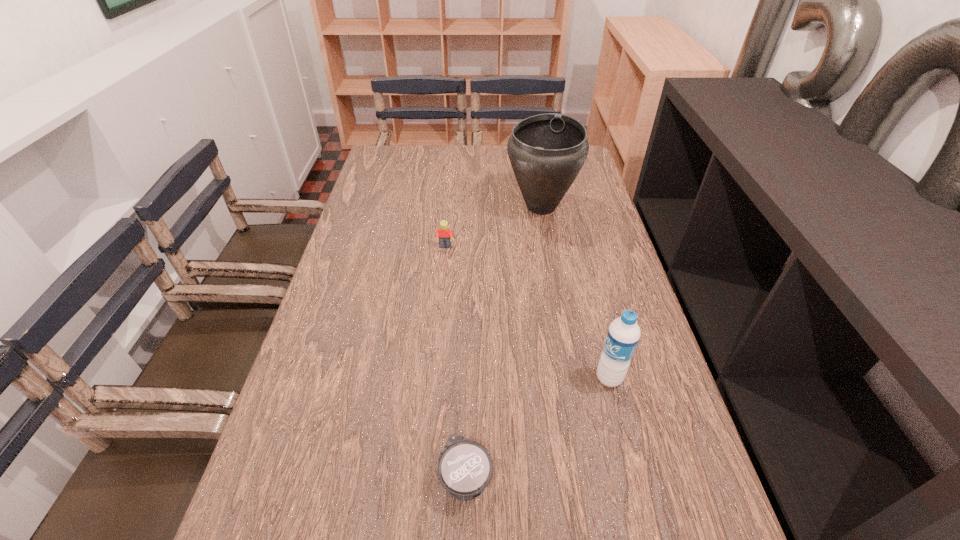
Identify the location of free spot between the third tallest object and the farthest object. The height and width of the screenshot is (540, 960). (493, 227).

Identify the location of free spot between the second farthest object and the water bottle. (527, 313).

Identify the location of empty space between the farthest object and the nearest object. This screenshot has height=540, width=960. (504, 342).

In order to click on blank region between the tallest object and the shortest object in this screenshot , I will do `click(504, 342)`.

You are a GUI agent. You are given a task and a screenshot of the screen. Output one action in this format:
    pyautogui.click(x=<x>, y=<y>)
    Task: Click on the blank region between the nearest object and the urn
    The width and height of the screenshot is (960, 540).
    Given the screenshot: What is the action you would take?
    pyautogui.click(x=504, y=342)

This screenshot has width=960, height=540. What are the coordinates of `blank region between the Lego and the second nearest object` in the screenshot? It's located at (527, 313).

At what (x,y) coordinates should I click in order to perform the action: click on free space between the water bottle and the second farthest object. Please return your answer as a coordinate pair (x, y). The width and height of the screenshot is (960, 540). Looking at the image, I should click on (527, 313).

Where is `free space between the second shortest object and the farthest object`? The image size is (960, 540). free space between the second shortest object and the farthest object is located at coordinates (493, 227).

Identify the location of free space between the farthest object and the water bottle. (575, 292).

Image resolution: width=960 pixels, height=540 pixels. Find the location of `object that is the second closest one to the shortest object`. object that is the second closest one to the shortest object is located at coordinates (444, 234).